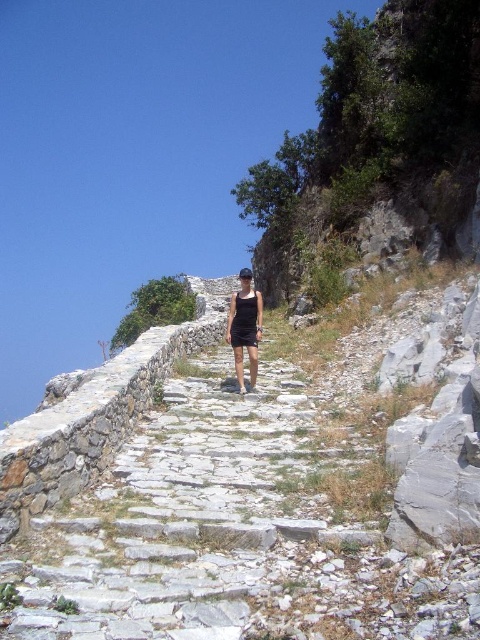
You are a hiker planning to take the stone path leading up the hill. You notice the green leafy hillside at upper right and the black matte shorts at center. Which object is located higher in the image?

The green leafy hillside at upper right is positioned over the black matte shorts at center, meaning it is higher in the image.

You are a photographer positioned at the bottom of the hill. You want to take a photo of the person walking along the pathway so that their black matte shorts at center are clearly visible in front of the green leafy hillside at upper right. Is this possible?

The black matte shorts at center is behind the green leafy hillside at upper right, so it will not be visible in front of it. Adjust your position or wait for the person to move closer to the hillside to capture the desired composition.